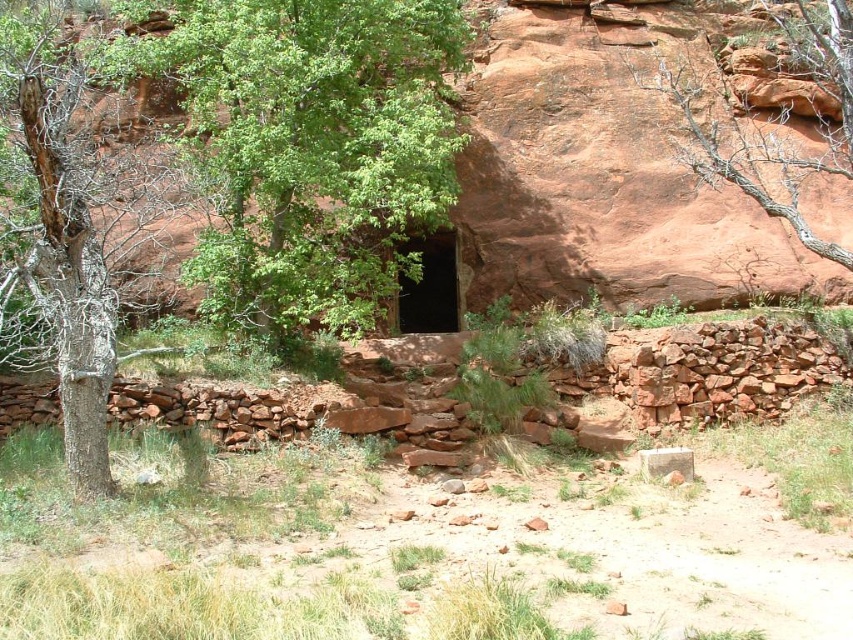
Question: Which object is farther from the camera taking this photo?

Choices:
 (A) bare wood tree at upper right
 (B) dead wood tree at left

Answer: (A)

Question: Does green leafy tree at center appear under black stone entrance at center?

Choices:
 (A) no
 (B) yes

Answer: (A)

Question: Which point appears closest to the camera in this image?

Choices:
 (A) (761, 136)
 (B) (325, 148)
 (C) (184, 209)
 (D) (450, 237)

Answer: (B)

Question: Which of these objects is positioned farthest from the black stone entrance at center?

Choices:
 (A) green leafy tree at center
 (B) dead wood tree at left

Answer: (B)

Question: Is green leafy tree at center to the left of dead wood tree at left from the viewer's perspective?

Choices:
 (A) yes
 (B) no

Answer: (B)

Question: Is green leafy tree at center further to camera compared to dead wood tree at left?

Choices:
 (A) no
 (B) yes

Answer: (B)